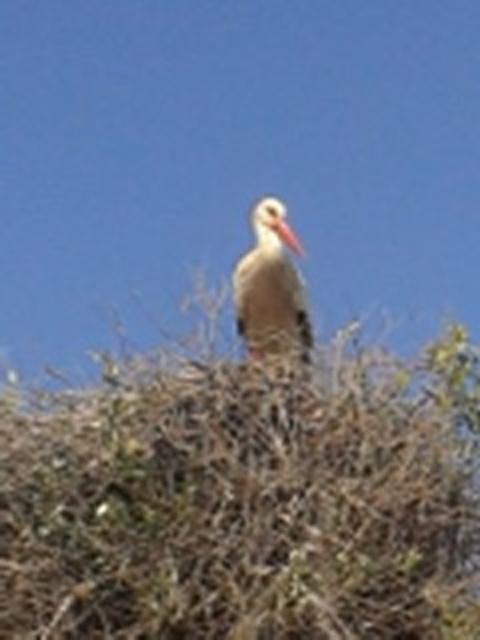
Who is lower down, brown textured nest at upper center or white matte beak at center?

brown textured nest at upper center is below.

Is brown textured nest at upper center below white matte beak at center?

Yes.

Locate an element on the screen. This screenshot has height=640, width=480. brown textured nest at upper center is located at coordinates (245, 497).

Can you confirm if white matte bird at center is positioned to the left of white matte beak at center?

Correct, you'll find white matte bird at center to the left of white matte beak at center.

Locate an element on the screen. The height and width of the screenshot is (640, 480). white matte bird at center is located at coordinates (271, 285).

Measure the distance from brown textured nest at upper center to white matte bird at center.

brown textured nest at upper center and white matte bird at center are 29.77 inches apart from each other.

The image size is (480, 640). Describe the element at coordinates (245, 497) in the screenshot. I see `brown textured nest at upper center` at that location.

Between point (108, 506) and point (260, 276), which one is positioned in front?

Point (108, 506)

Locate an element on the screen. This screenshot has height=640, width=480. brown textured nest at upper center is located at coordinates (245, 497).